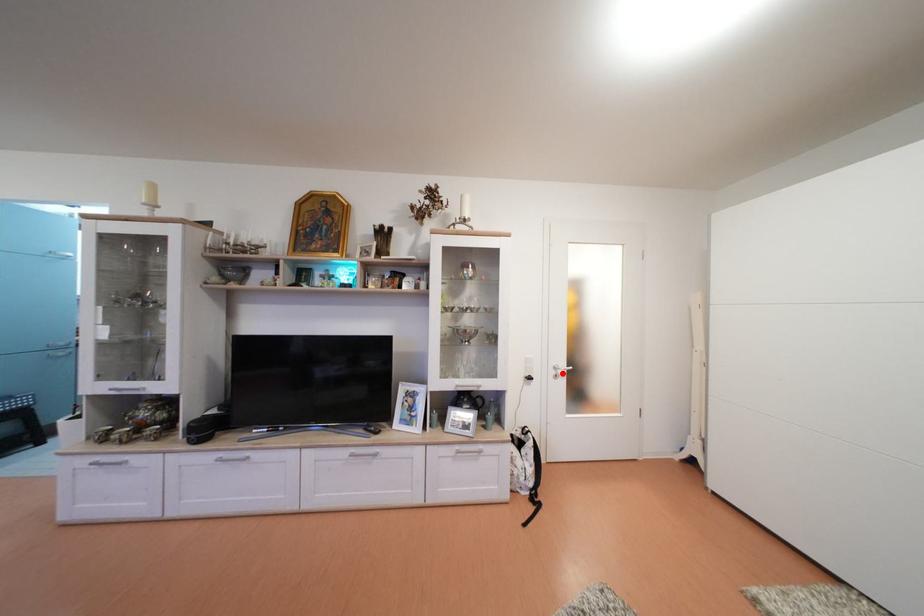
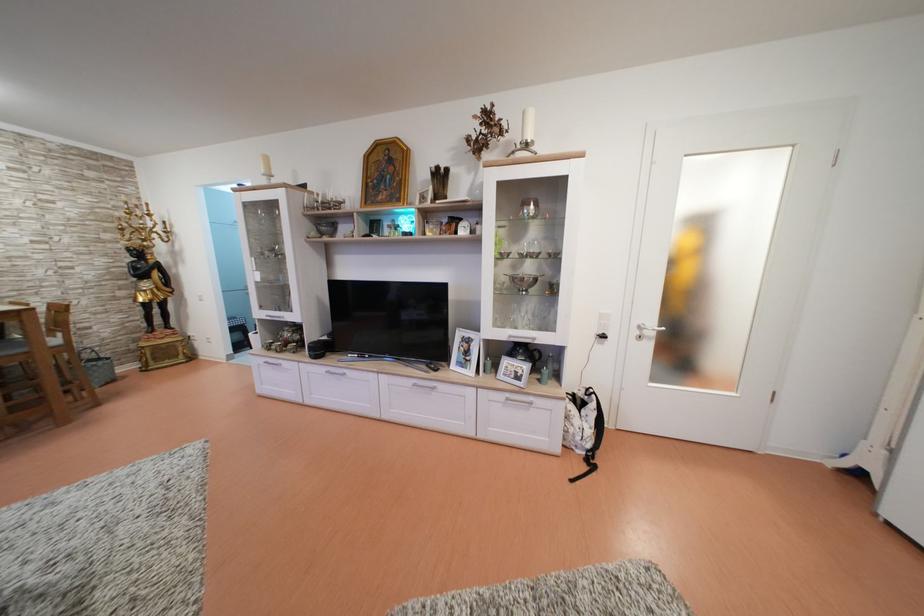
Question: I am providing you with two images of the same scene from different viewpoints. Given a red point in image1, look at the same physical point in image2. Is it:

Choices:
 (A) Closer to the viewpoint
 (B) Farther from the viewpoint

Answer: (A)